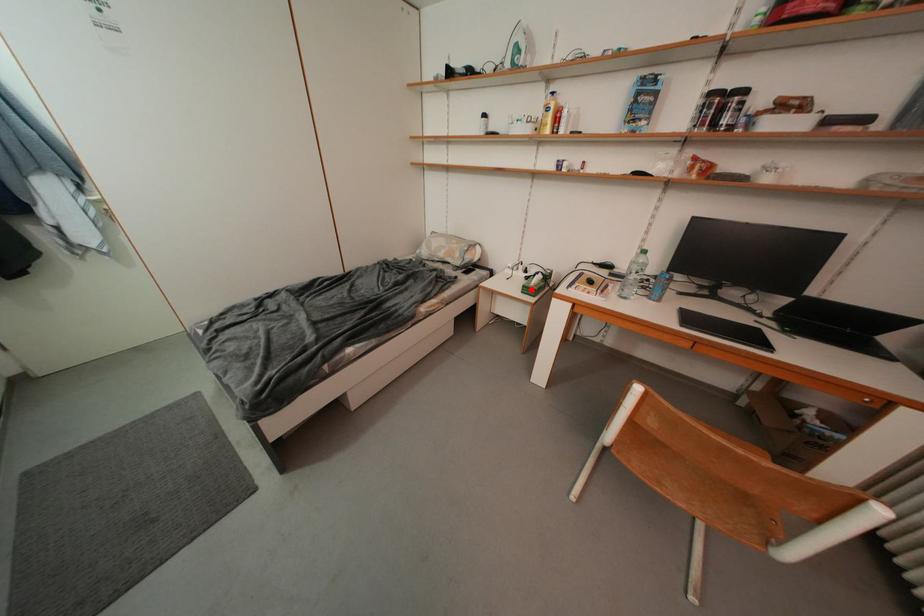
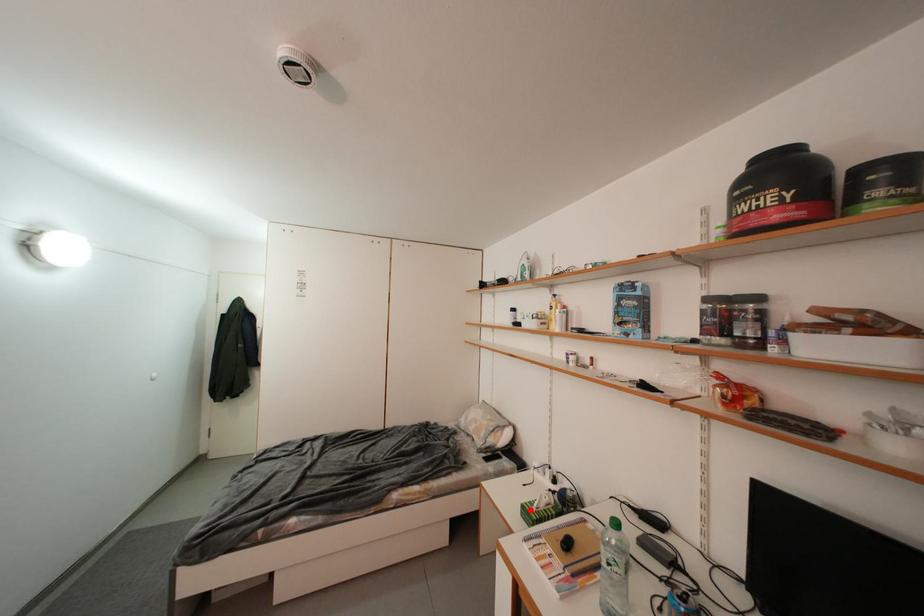
I am providing you with two images of the same scene from different viewpoints. A red point is marked on the first image and another point is marked on the second image. Are the points marked in image1 and image2 representing the same 3D position?

Yes